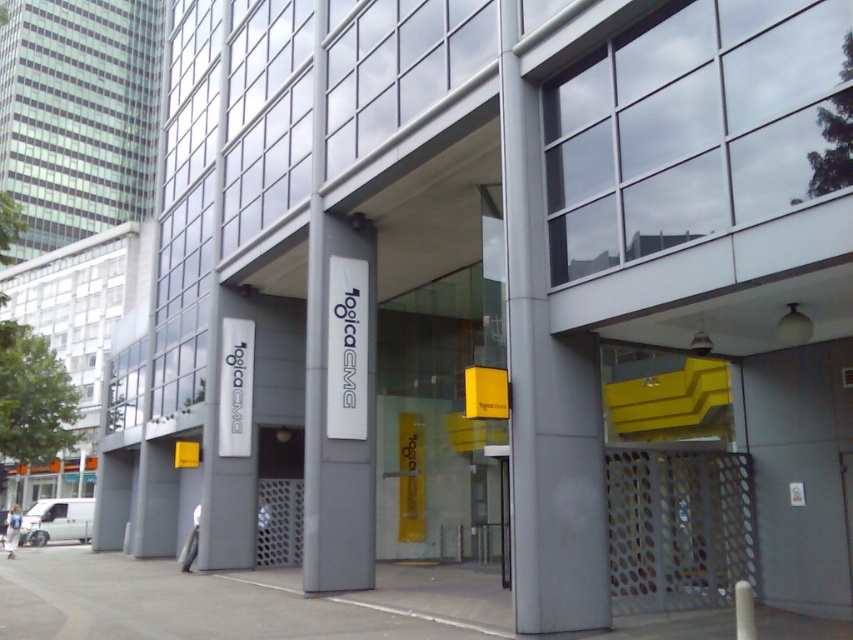
Does gray metallic sign at center appear on the left side of white matte van at lower left?

Incorrect, gray metallic sign at center is not on the left side of white matte van at lower left.

Consider the image. Is gray metallic sign at center above white matte van at lower left?

Indeed, gray metallic sign at center is positioned over white matte van at lower left.

Describe the element at coordinates (338, 406) in the screenshot. I see `gray metallic sign at center` at that location.

Locate an element on the screen. This screenshot has width=853, height=640. gray metallic sign at center is located at coordinates (338, 406).